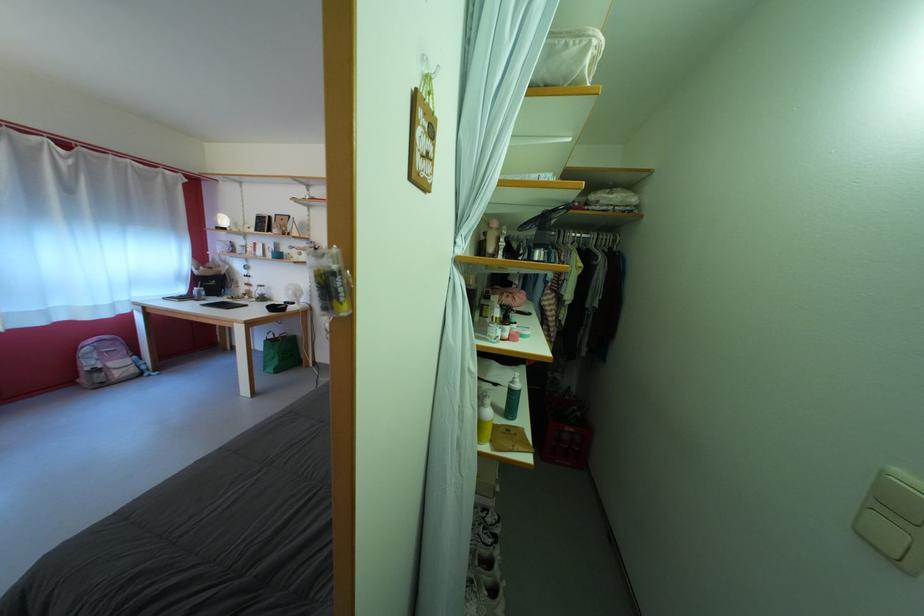
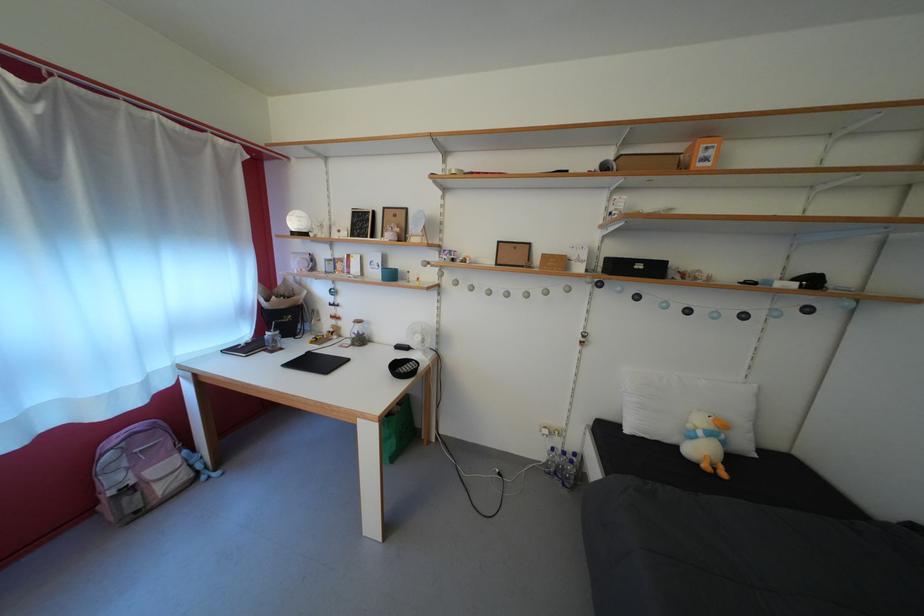
Find the pixel in the second image that matches (99,370) in the first image.

(123, 485)